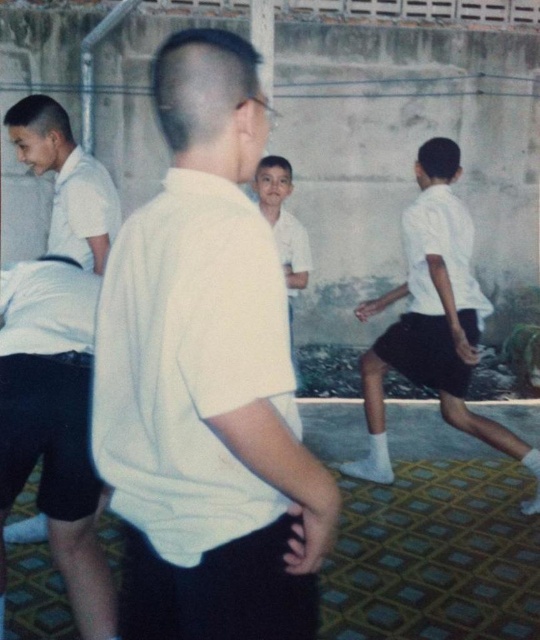
Who is positioned more to the left, white matte shirt at right or white smooth shirt at center?

white smooth shirt at center is more to the left.

Is point (428, 140) closer to viewer compared to point (256, 193)?

Yes, point (428, 140) is closer to viewer.

Identify the location of white matte shirt at right. (434, 321).

Measure the distance between point (165, 195) and camera.

4.38 feet

Is white matte shirt at center above white smooth shirt at center?

No, white matte shirt at center is not above white smooth shirt at center.

Where is `white matte shirt at center`? white matte shirt at center is located at coordinates (206, 378).

Does white matte shirt at center appear on the right side of white matte shirt at right?

Incorrect, white matte shirt at center is not on the right side of white matte shirt at right.

Between point (174, 145) and point (429, 214), which one is positioned in front?

Point (174, 145) is more forward.

This screenshot has height=640, width=540. In order to click on white matte shirt at center in this screenshot , I will do [206, 378].